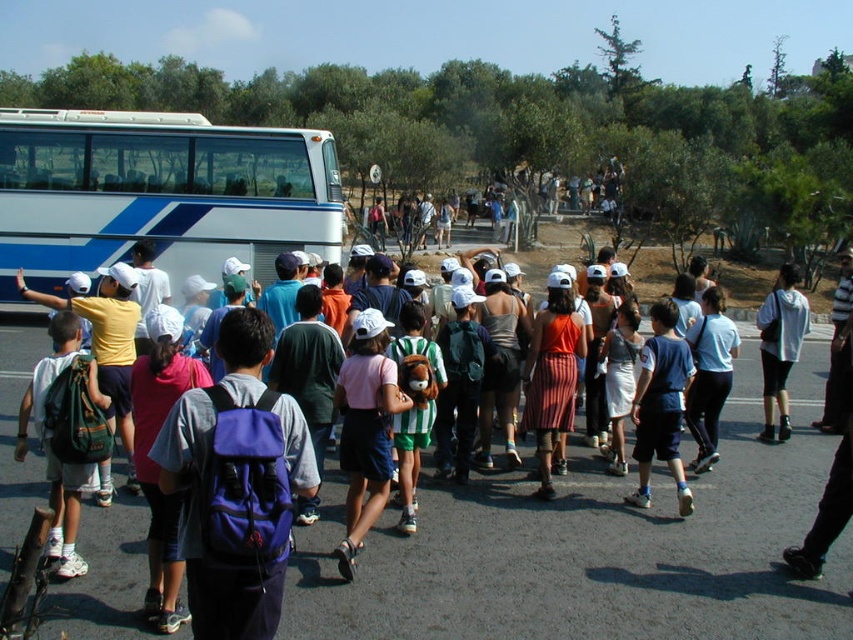
You are a photographer trying to capture a photo of the matte green backpack at left and the gray hoodie at center. Since you want to ensure both are fully visible in the frame, which object should you focus on first to avoid cropping the taller one?

The gray hoodie at center is taller than the matte green backpack at left, so you should focus on ensuring the gray hoodie at center fits in the frame first to avoid cropping the taller object.